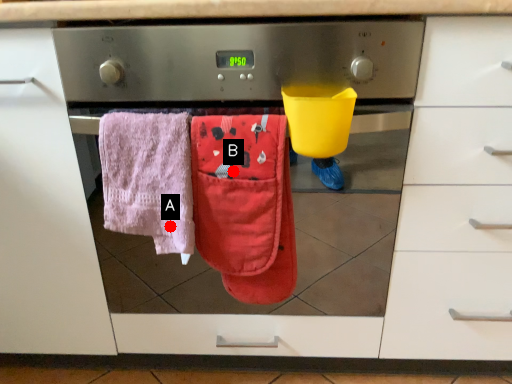
Question: Two points are circled on the image, labeled by A and B beside each circle. Which of the following is the closest to the observer?

Choices:
 (A) A is closer
 (B) B is closer

Answer: (B)